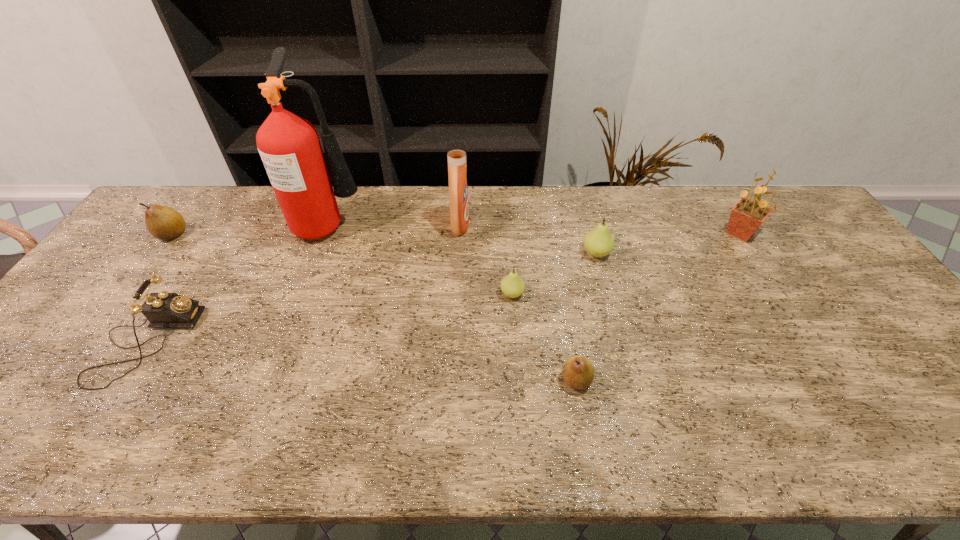
At what (x,y) coordinates should I click in order to perform the action: click on vacant area between the right brown pear and the rightmost object. Please return your answer as a coordinate pair (x, y). The width and height of the screenshot is (960, 540). Looking at the image, I should click on (659, 307).

I want to click on vacant area that lies between the smaller green pear and the bigger green pear, so click(554, 274).

Where is `vacant space that's between the left green pear and the detergent`? vacant space that's between the left green pear and the detergent is located at coordinates (486, 260).

Where is `blank region between the second nearest pear and the telephone`? blank region between the second nearest pear and the telephone is located at coordinates (329, 318).

Locate an element on the screen. This screenshot has width=960, height=540. free space that is in between the bigger brown pear and the fire extinguisher is located at coordinates (252, 229).

I want to click on free space that is in between the detergent and the third object from left to right, so click(x=396, y=225).

Select which object appears as the seventh closest to the fire extinguisher. Please provide its 2D coordinates. Your answer should be formatted as a tuple, i.e. [(x, y)], where the tuple contains the x and y coordinates of a point satisfying the conditions above.

[(747, 215)]

This screenshot has width=960, height=540. I want to click on object that stands as the fifth closest to the farther brown pear, so click(578, 372).

Locate which pear ranks third in proximity to the smaller brown pear. Please provide its 2D coordinates. Your answer should be formatted as a tuple, i.e. [(x, y)], where the tuple contains the x and y coordinates of a point satisfying the conditions above.

[(164, 223)]

Where is `the closest pear to the fifth object from right to left`? The width and height of the screenshot is (960, 540). the closest pear to the fifth object from right to left is located at coordinates (512, 285).